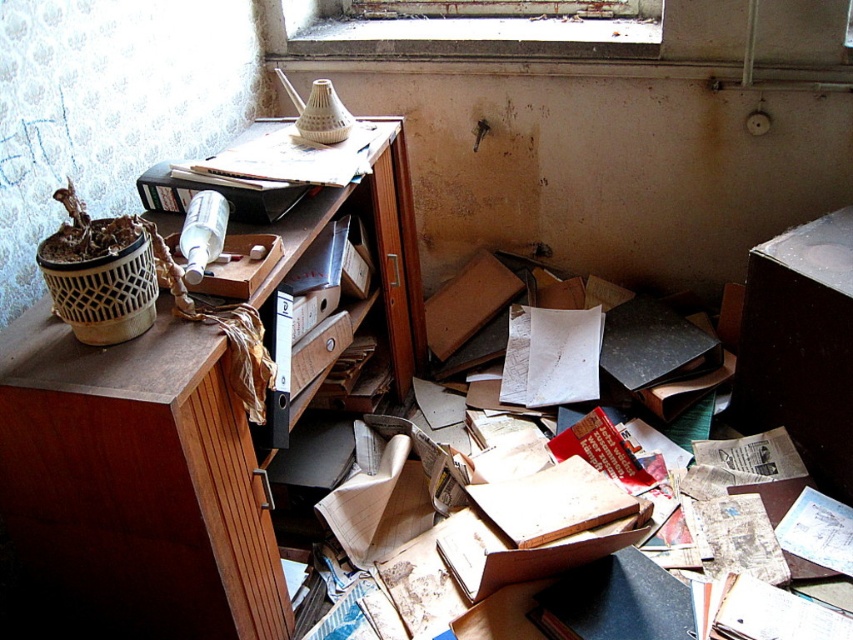
Question: Where is clear glass window at upper center located in relation to wooden drawer at center in the image?

Choices:
 (A) left
 (B) right

Answer: (B)

Question: Which point is farther to the camera?

Choices:
 (A) (325, 355)
 (B) (310, 10)
 (C) (33, 456)

Answer: (B)

Question: Is brown wood dresser at upper left to the left of wooden drawer at center from the viewer's perspective?

Choices:
 (A) no
 (B) yes

Answer: (B)

Question: Is clear glass window at upper center smaller than wooden drawer at center?

Choices:
 (A) yes
 (B) no

Answer: (B)

Question: Considering the real-world distances, which object is farthest from the brown wood dresser at upper left?

Choices:
 (A) wooden drawer at center
 (B) clear glass window at upper center

Answer: (B)

Question: Which point is farther to the camera?

Choices:
 (A) (641, 19)
 (B) (175, 522)

Answer: (A)